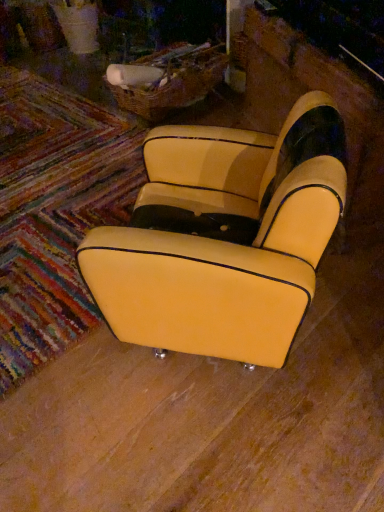
In order to click on yellow leather armchair at center in this screenshot , I will do `click(224, 241)`.

What do you see at coordinates (224, 241) in the screenshot? I see `yellow leather armchair at center` at bounding box center [224, 241].

The width and height of the screenshot is (384, 512). Find the location of `yellow leather mat at lower left`. yellow leather mat at lower left is located at coordinates (54, 211).

The image size is (384, 512). Describe the element at coordinates (54, 211) in the screenshot. I see `yellow leather mat at lower left` at that location.

The width and height of the screenshot is (384, 512). What are the coordinates of `yellow leather armchair at center` in the screenshot? It's located at (224, 241).

Is yellow leather armchair at center to the right of yellow leather mat at lower left from the viewer's perspective?

Indeed, yellow leather armchair at center is positioned on the right side of yellow leather mat at lower left.

Is yellow leather armchair at center closer to the viewer compared to yellow leather mat at lower left?

Yes.

Which is farther from the camera, (284, 346) or (20, 189)?

The point (20, 189) is more distant.

From the image's perspective, is yellow leather armchair at center beneath yellow leather mat at lower left?

Yes.

From a real-world perspective, which object rests below the other?

yellow leather mat at lower left.

Is yellow leather armchair at center wider or thinner than yellow leather mat at lower left?

Considering their sizes, yellow leather armchair at center looks slimmer than yellow leather mat at lower left.

Who is taller, yellow leather armchair at center or yellow leather mat at lower left?

yellow leather armchair at center is taller.

Who is smaller, yellow leather armchair at center or yellow leather mat at lower left?

yellow leather mat at lower left.

Does yellow leather armchair at center contain yellow leather mat at lower left?

No, yellow leather mat at lower left is located outside of yellow leather armchair at center.

Is yellow leather armchair at center next to yellow leather mat at lower left?

No, yellow leather armchair at center is not making contact with yellow leather mat at lower left.

Is yellow leather armchair at center turned away from yellow leather mat at lower left?

No.

How many degrees apart are the facing directions of yellow leather armchair at center and yellow leather mat at lower left?

The angular difference between yellow leather armchair at center and yellow leather mat at lower left is 57.3 degrees.

Locate an element on the screen. chair above the yellow leather mat at lower left (from a real-world perspective) is located at coordinates (224, 241).

Between yellow leather mat at lower left and yellow leather armchair at center, which one appears on the right side from the viewer's perspective?

From the viewer's perspective, yellow leather armchair at center appears more on the right side.

Is the position of yellow leather mat at lower left more distant than that of yellow leather armchair at center?

Yes, yellow leather mat at lower left is behind yellow leather armchair at center.

Considering the points (0, 170) and (208, 257), which point is in front, point (0, 170) or point (208, 257)?

The point (208, 257) is more forward.

From the image's perspective, which object appears higher, yellow leather mat at lower left or yellow leather armchair at center?

yellow leather mat at lower left is shown above in the image.

From a real-world perspective, which is physically above, yellow leather mat at lower left or yellow leather armchair at center?

yellow leather armchair at center.

Does yellow leather mat at lower left have a greater width compared to yellow leather armchair at center?

Indeed, yellow leather mat at lower left has a greater width compared to yellow leather armchair at center.

Does yellow leather mat at lower left have a greater height compared to yellow leather armchair at center?

No, yellow leather mat at lower left is not taller than yellow leather armchair at center.

In terms of size, does yellow leather mat at lower left appear bigger or smaller than yellow leather armchair at center?

Clearly, yellow leather mat at lower left is smaller in size than yellow leather armchair at center.

Consider the image. Is yellow leather armchair at center surrounded by yellow leather mat at lower left?

Actually, yellow leather armchair at center is outside yellow leather mat at lower left.

Is yellow leather mat at lower left far from yellow leather armchair at center?

That's not correct — yellow leather mat at lower left is a little close to yellow leather armchair at center.

Is yellow leather mat at lower left looking in the opposite direction of yellow leather armchair at center?

That's not correct — yellow leather mat at lower left is not looking away from yellow leather armchair at center.

What's the angular difference between yellow leather mat at lower left and yellow leather armchair at center's facing directions?

yellow leather mat at lower left and yellow leather armchair at center are facing 57.3 degrees away from each other.

Find the location of a particular element. Image resolution: width=384 pixels, height=512 pixels. mat below the yellow leather armchair at center (from a real-world perspective) is located at coordinates (54, 211).

Locate an element on the screen. This screenshot has width=384, height=512. mat lying behind the yellow leather armchair at center is located at coordinates (54, 211).

At what (x,y) coordinates should I click in order to perform the action: click on mat lying above the yellow leather armchair at center (from the image's perspective). Please return your answer as a coordinate pair (x, y). The height and width of the screenshot is (512, 384). Looking at the image, I should click on tap(54, 211).